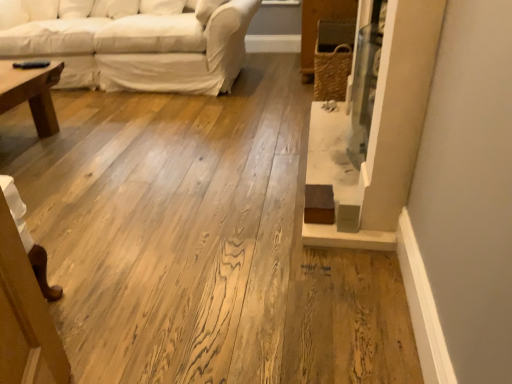
The height and width of the screenshot is (384, 512). What do you see at coordinates (132, 41) in the screenshot?
I see `white fabric couch at upper left` at bounding box center [132, 41].

Locate an element on the screen. The image size is (512, 384). white fabric couch at upper left is located at coordinates (132, 41).

Locate an element on the screen. white fabric couch at upper left is located at coordinates click(x=132, y=41).